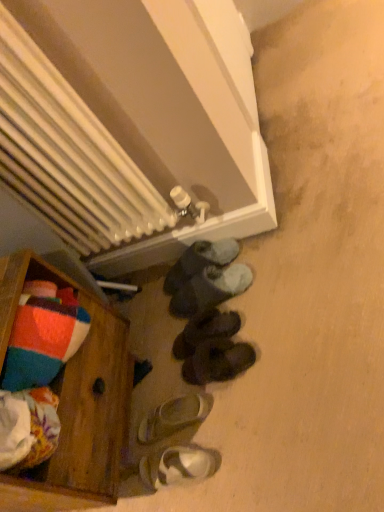
Where is `free space to the back side of white matte sandals at lower center, placed as the sixth footwear when sorted from top to bottom`? This screenshot has height=512, width=384. free space to the back side of white matte sandals at lower center, placed as the sixth footwear when sorted from top to bottom is located at coordinates (150, 416).